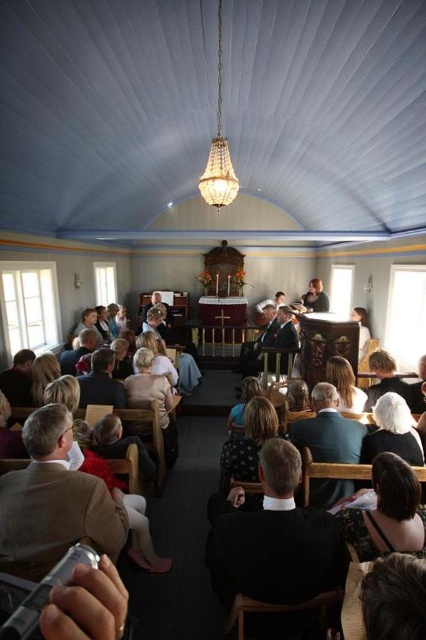
You are sitting in the light brown wooden chair at lower left and want to reach the matte black jacket at lower left. Can you easily access it without moving from your seat?

The light brown wooden chair at lower left is in front of the matte black jacket at lower left, meaning the jacket is behind the chair. Since you are sitting in the chair, the jacket would be behind you and easily accessible by reaching back.